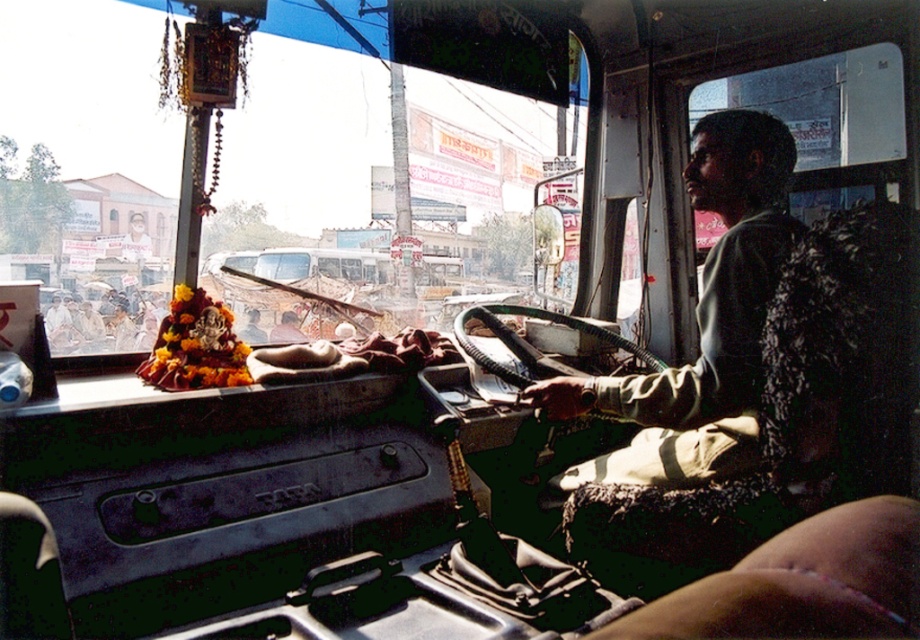
Question: Among these objects, which one is nearest to the camera?

Choices:
 (A) smooth skin at lower right
 (B) transparent glass windshield at upper center

Answer: (A)

Question: Where is transparent glass windshield at upper center located in relation to smooth skin at lower right in the image?

Choices:
 (A) right
 (B) left

Answer: (B)

Question: Can you confirm if transparent glass windshield at upper center is positioned above smooth skin at lower right?

Choices:
 (A) yes
 (B) no

Answer: (A)

Question: Among these points, which one is nearest to the camera?

Choices:
 (A) pyautogui.click(x=75, y=250)
 (B) pyautogui.click(x=917, y=524)

Answer: (B)

Question: Is transparent glass windshield at upper center positioned at the back of smooth skin at lower right?

Choices:
 (A) no
 (B) yes

Answer: (B)

Question: Which of the following is the closest to the observer?

Choices:
 (A) smooth skin at lower right
 (B) transparent glass windshield at upper center

Answer: (A)